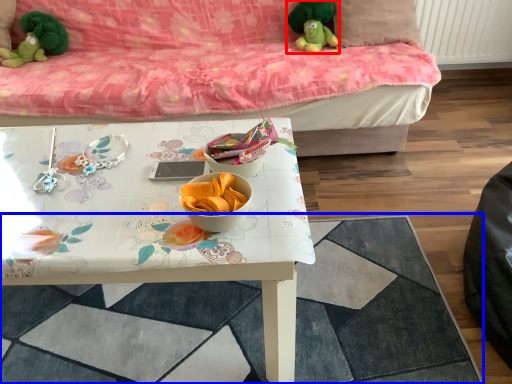
Question: Among these objects, which one is farthest to the camera, toy (highlighted by a red box) or tile (highlighted by a blue box)?

Choices:
 (A) toy
 (B) tile

Answer: (A)